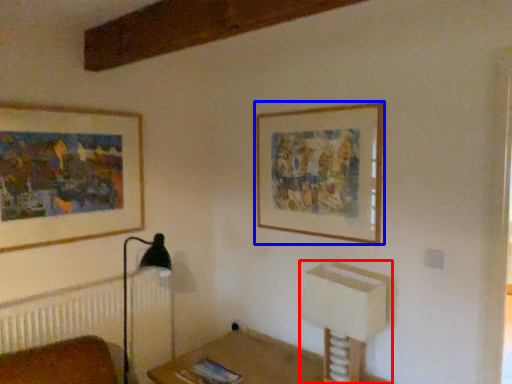
Question: Which object appears closest to the camera in this image, vanity (highlighted by a red box) or picture frame (highlighted by a blue box)?

Choices:
 (A) vanity
 (B) picture frame

Answer: (A)